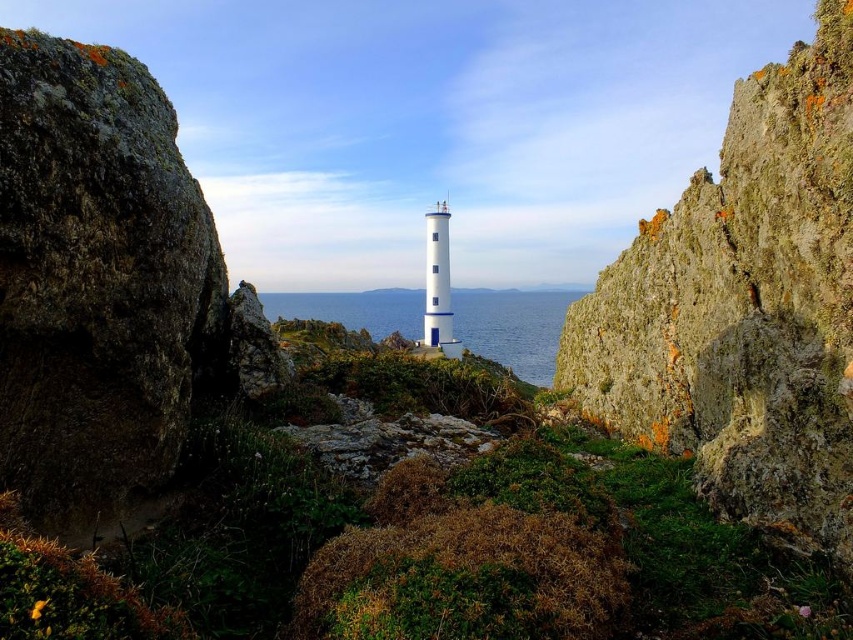
Who is positioned more to the left, rusty rock cliff at center right or blue water at center?

Positioned to the left is rusty rock cliff at center right.

Who is more distant from viewer, (843, 262) or (560, 314)?

Positioned behind is point (560, 314).

Is point (763, 252) positioned before point (480, 326)?

Yes, point (763, 252) is in front of point (480, 326).

Where is `rusty rock cliff at center right`? This screenshot has height=640, width=853. rusty rock cliff at center right is located at coordinates (744, 307).